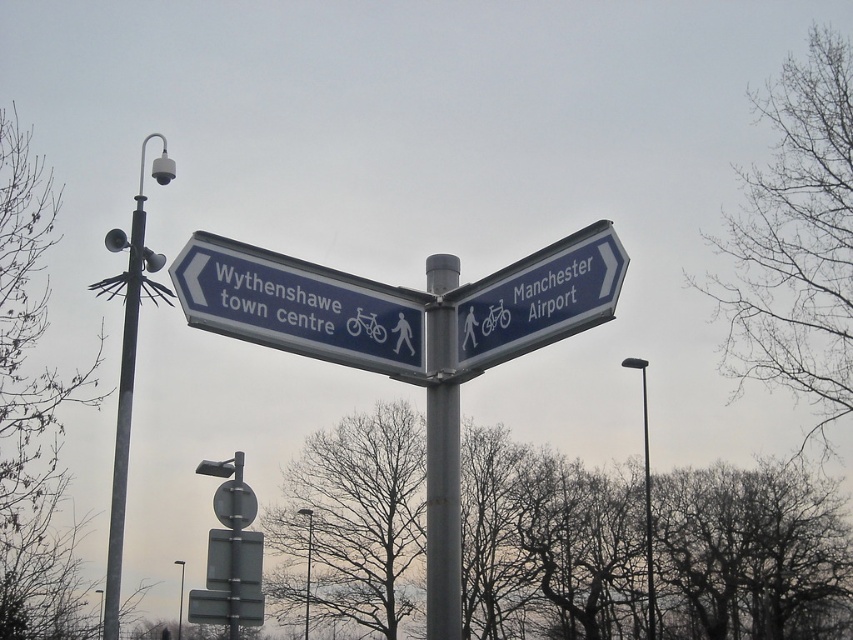
Is bare branches at left taller than blue plastic manchester airport sign at upper right?

Correct, bare branches at left is much taller as blue plastic manchester airport sign at upper right.

How far apart are bare branches at left and blue plastic manchester airport sign at upper right?

bare branches at left and blue plastic manchester airport sign at upper right are 25.83 meters apart.

The image size is (853, 640). Identify the location of bare branches at left. (32, 410).

Locate an element on the screen. This screenshot has height=640, width=853. bare branches at left is located at coordinates (32, 410).

Does blue plastic manchester airport sign at upper right have a greater height compared to black metal pole at right?

No.

Does point (577, 266) lie behind point (647, 429)?

No, it is not.

I want to click on blue plastic manchester airport sign at upper right, so click(538, 298).

Who is positioned more to the left, bare branches at left or brushed metal lamp post at center?

From the viewer's perspective, bare branches at left appears more on the left side.

Can you confirm if bare branches at left is shorter than brushed metal lamp post at center?

No, bare branches at left is not shorter than brushed metal lamp post at center.

Is point (12, 355) positioned behind point (306, 621)?

No, it is in front of (306, 621).

Where is `bare branches at left`? The width and height of the screenshot is (853, 640). bare branches at left is located at coordinates (32, 410).